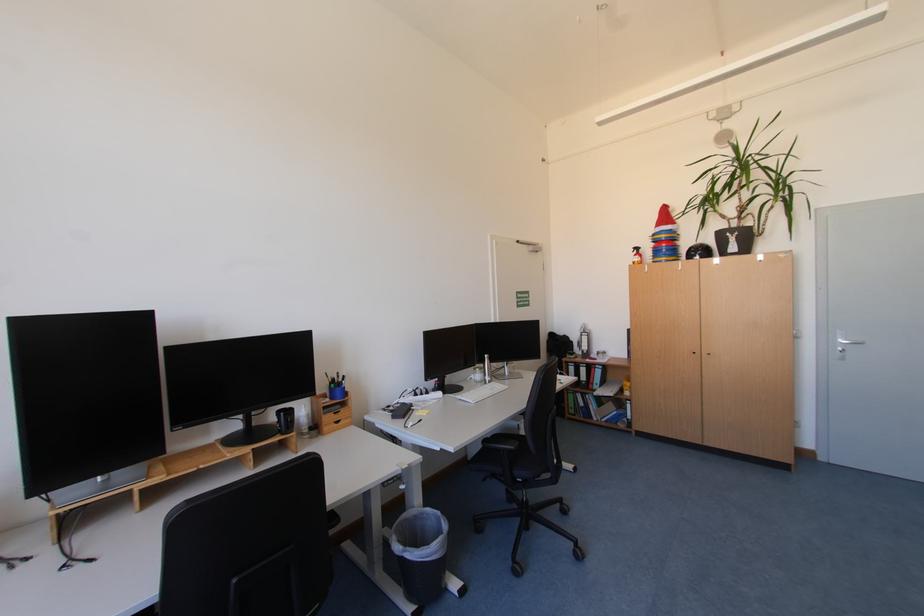
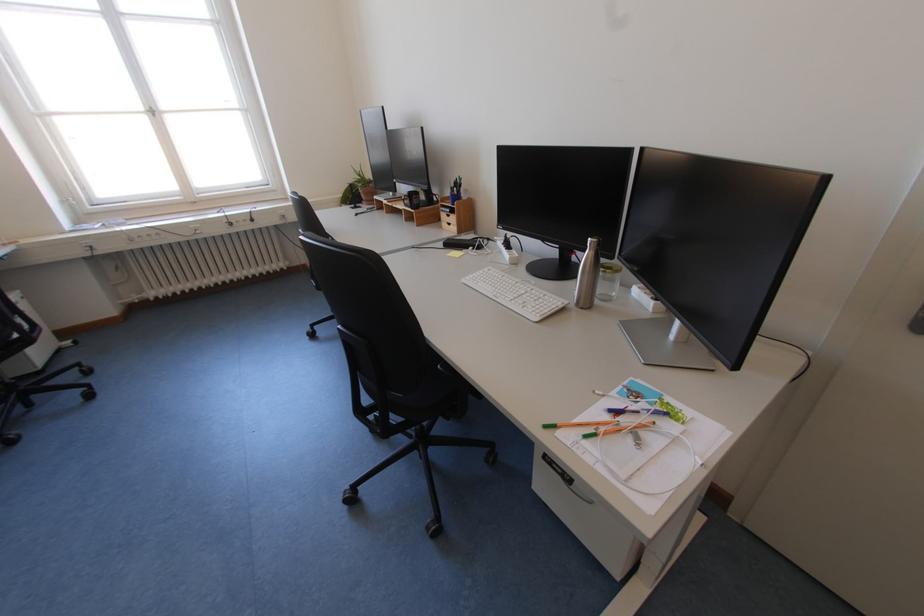
Locate, in the second image, the point that corresponds to (x=493, y=357) in the first image.

(599, 240)